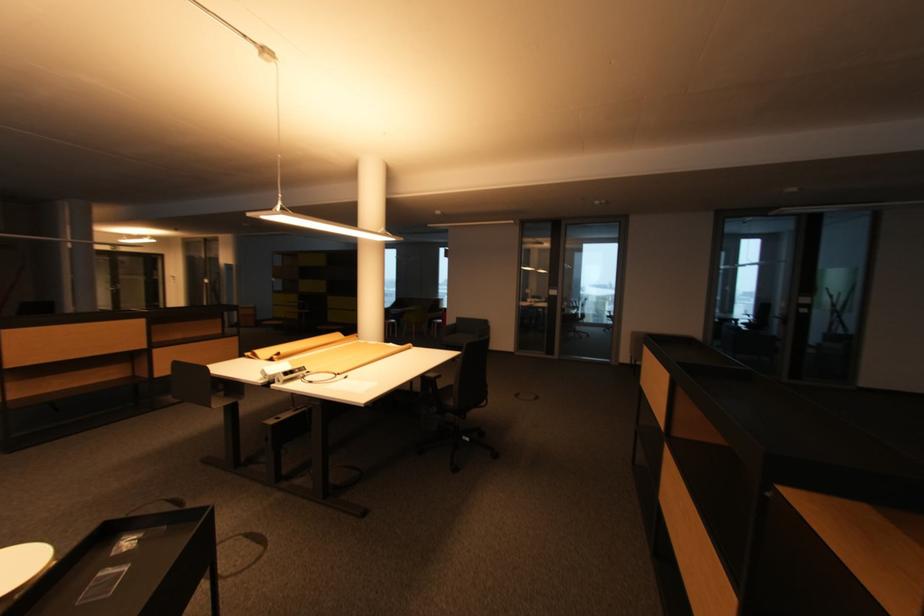
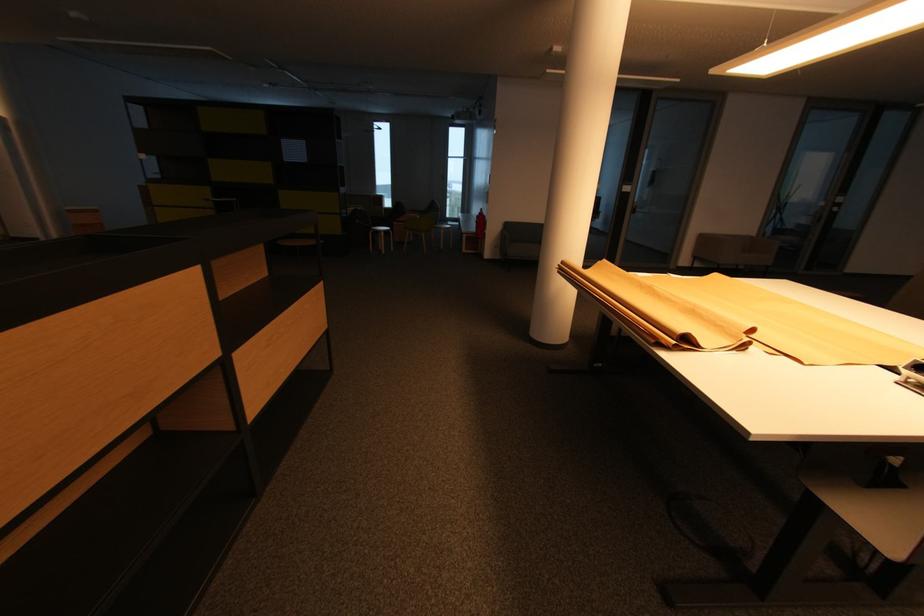
In the scene shown: What movement of the cameraman would produce the second image?

The cameraman walked toward left, forward.